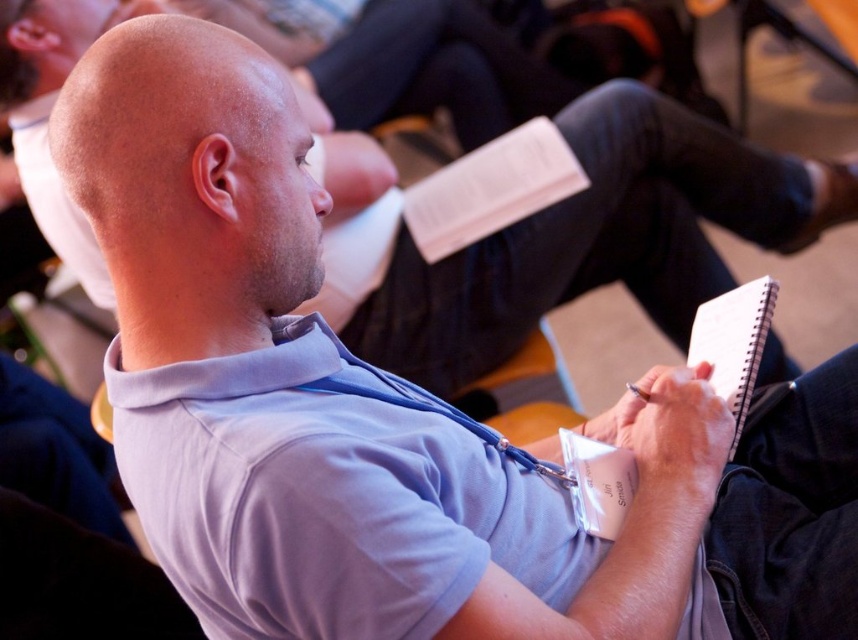
You are organizing a conference and need to place a name tag on the table where the white spiral notebook at lower right and the white paper notepad at center are located. If you want the name tag to be between them, where should you place it?

The name tag should be placed between the white spiral notebook at lower right and the white paper notepad at center, as the white spiral notebook at lower right is on the right side of the white paper notepad at center.

You are organizing a workshop and need to stack the white paper journal at center and the white spiral notebook at lower right. Which one should you place on top to match their current positions in the image?

The white paper journal at center should be placed on top of the white spiral notebook at lower right since it is positioned above it in the image.

You are organizing a workshop and need to determine which writing surface is taller for participants to use. Which object is taller between the white spiral notebook at lower right and the white paper notepad at center?

The white spiral notebook at lower right is taller than the white paper notepad at center.